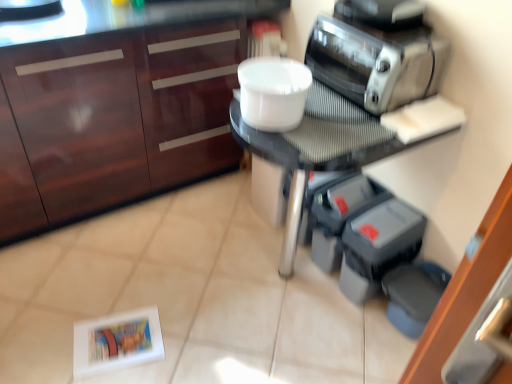
This screenshot has height=384, width=512. I want to click on free spot to the left of gray plastic containers at lower right, marked as the second appliance in a right-to-left arrangement, so click(x=291, y=263).